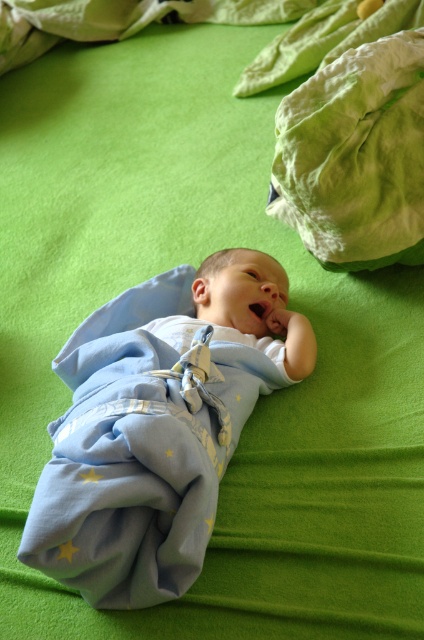
Measure the distance from blue soft swaddle at center to green cotton cloth at upper right.

blue soft swaddle at center and green cotton cloth at upper right are 43.58 centimeters apart from each other.

Which is below, blue soft swaddle at center or green cotton cloth at upper right?

Positioned lower is blue soft swaddle at center.

What are the coordinates of `blue soft swaddle at center` in the screenshot? It's located at (158, 426).